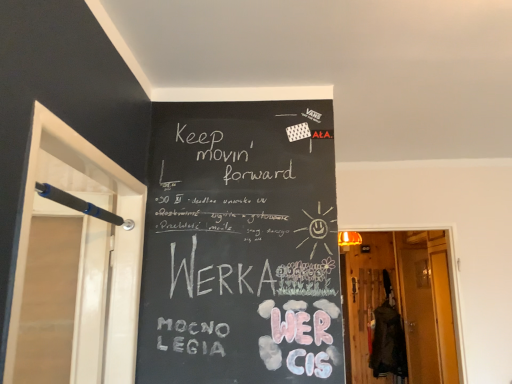
Question: Is black plastic screen door at left, placed as the second screen door when sorted from back to front, touching translucent glass screen door at right, the second screen door when ordered from front to back?

Choices:
 (A) yes
 (B) no

Answer: (B)

Question: Is black plastic screen door at left, the 1th screen door from the front, outside of translucent glass screen door at right, acting as the second screen door starting from the left?

Choices:
 (A) yes
 (B) no

Answer: (A)

Question: Does black plastic screen door at left, placed as the second screen door when sorted from back to front, contain translucent glass screen door at right, which appears as the first screen door when viewed from the right?

Choices:
 (A) yes
 (B) no

Answer: (B)

Question: Considering the relative sizes of black plastic screen door at left, which appears as the 2th screen door when ordered from the bottom, and translucent glass screen door at right, which ranks as the 2th screen door in top-to-bottom order, in the image provided, is black plastic screen door at left, which appears as the 2th screen door when ordered from the bottom, thinner than translucent glass screen door at right, which ranks as the 2th screen door in top-to-bottom order,?

Choices:
 (A) no
 (B) yes

Answer: (A)

Question: Could you tell me if black plastic screen door at left, the second screen door viewed from the right, is turned towards translucent glass screen door at right, the 1th screen door positioned from the back?

Choices:
 (A) no
 (B) yes

Answer: (A)

Question: Is black plastic screen door at left, the 1th screen door when ordered from left to right, shorter than translucent glass screen door at right, which ranks as the 2th screen door in top-to-bottom order?

Choices:
 (A) no
 (B) yes

Answer: (B)

Question: Are black plastic screen door at left, placed as the second screen door when sorted from back to front, and wooden door at center located far from each other?

Choices:
 (A) no
 (B) yes

Answer: (B)

Question: Is the depth of black plastic screen door at left, which appears as the 2th screen door when ordered from the bottom, greater than that of wooden door at center?

Choices:
 (A) yes
 (B) no

Answer: (B)

Question: Can you confirm if black plastic screen door at left, positioned as the first screen door in top-to-bottom order, is smaller than wooden door at center?

Choices:
 (A) no
 (B) yes

Answer: (A)

Question: Can wooden door at center be found inside black plastic screen door at left, placed as the second screen door when sorted from back to front?

Choices:
 (A) no
 (B) yes

Answer: (A)

Question: Does black plastic screen door at left, the 1th screen door from the front, have a greater height compared to wooden door at center?

Choices:
 (A) yes
 (B) no

Answer: (B)

Question: From the image's perspective, is black plastic screen door at left, which appears as the 2th screen door when ordered from the bottom, beneath wooden door at center?

Choices:
 (A) no
 (B) yes

Answer: (A)

Question: Is translucent glass screen door at right, the second screen door when ordered from front to back, placed right next to wooden door at center?

Choices:
 (A) yes
 (B) no

Answer: (B)